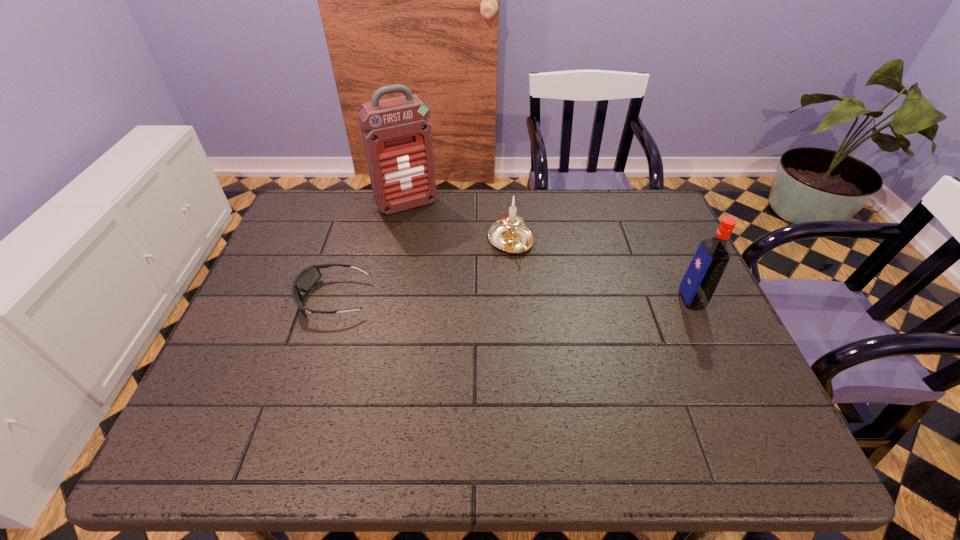
This screenshot has height=540, width=960. I want to click on vacant space situated on the front-facing side of the first-aid kit, so click(x=428, y=233).

I want to click on free spot located 0.310m on the front-facing side of the first-aid kit, so click(x=457, y=280).

Identify the location of vacant region located on the front-facing side of the first-aid kit. (442, 255).

Image resolution: width=960 pixels, height=540 pixels. Find the location of `vacant position located on the handle side of the third tallest object`. vacant position located on the handle side of the third tallest object is located at coordinates (579, 348).

This screenshot has width=960, height=540. I want to click on vacant position located 0.210m on the handle side of the third tallest object, so click(x=556, y=314).

This screenshot has height=540, width=960. What are the coordinates of `free location located 0.250m on the handle side of the third tallest object` in the screenshot? It's located at (564, 326).

You are a GUI agent. You are given a task and a screenshot of the screen. Output one action in this format:
    pyautogui.click(x=<x>, y=<y>)
    Task: Click on the first-aid kit situated at the far edge
    This screenshot has height=540, width=960.
    Given the screenshot: What is the action you would take?
    pyautogui.click(x=397, y=137)

This screenshot has height=540, width=960. I want to click on candle holder located at the far edge, so click(x=509, y=234).

The image size is (960, 540). What are the coordinates of `object that is at the left edge` in the screenshot? It's located at (304, 281).

Locate an element on the screen. This screenshot has width=960, height=540. object that is at the right edge is located at coordinates (702, 277).